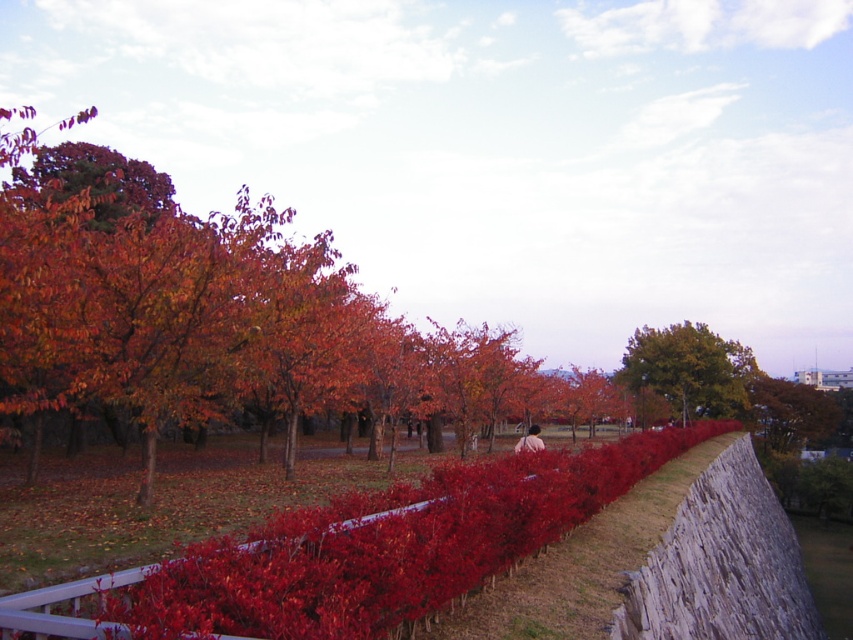
Question: Among these objects, which one is farthest from the camera?

Choices:
 (A) green leafy tree at upper right
 (B) bright red hedge at center

Answer: (A)

Question: Is bright red hedge at center above green leafy tree at upper right?

Choices:
 (A) yes
 (B) no

Answer: (A)

Question: Among these points, which one is nearest to the camera?

Choices:
 (A) (428, 481)
 (B) (618, 372)

Answer: (A)

Question: Does bright red hedge at center have a greater width compared to green leafy tree at upper right?

Choices:
 (A) no
 (B) yes

Answer: (A)

Question: Does bright red hedge at center have a smaller size compared to green leafy tree at upper right?

Choices:
 (A) yes
 (B) no

Answer: (A)